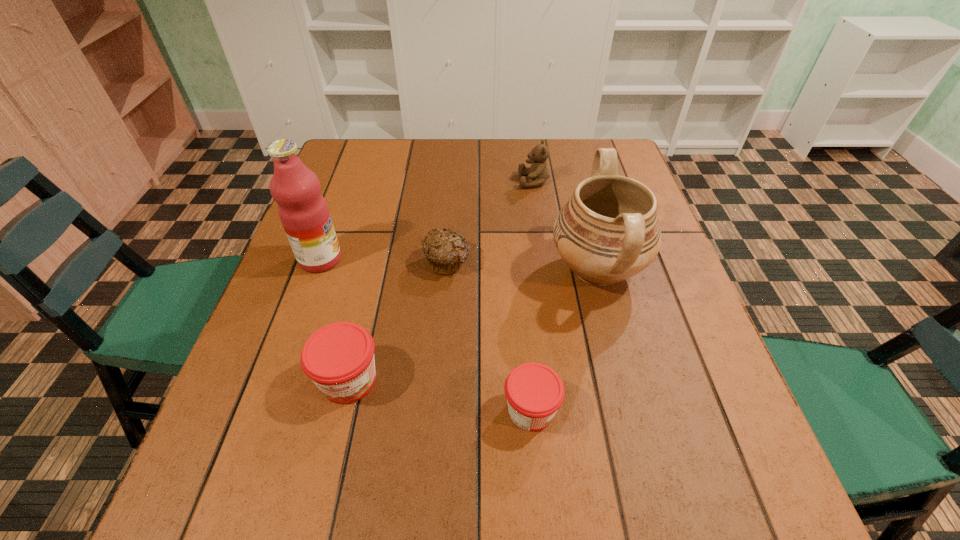
The width and height of the screenshot is (960, 540). Find the location of `vacant place for an extra jam on the right`. vacant place for an extra jam on the right is located at coordinates 734,444.